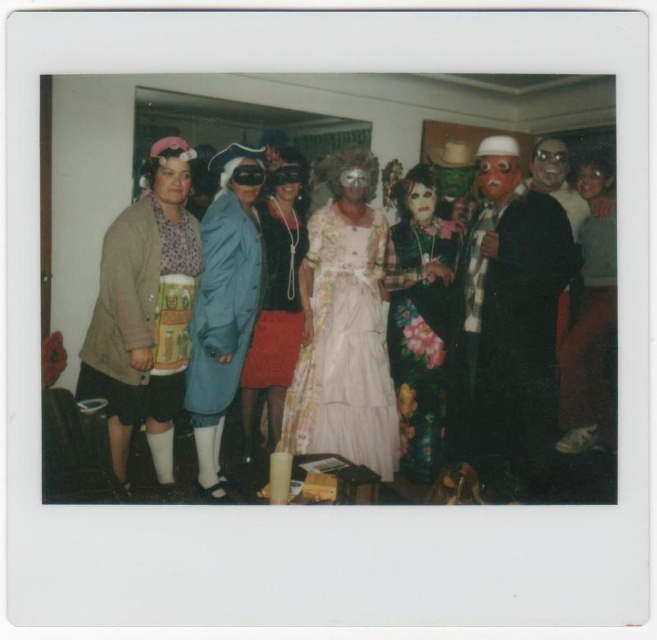
Question: Does floral fabric dress at center appear on the left side of velvet black dress at center?

Choices:
 (A) yes
 (B) no

Answer: (B)

Question: Which point is farther to the camera?

Choices:
 (A) matte blue coat at center
 (B) floral lace dress at center
 (C) floral-patterned dress at center

Answer: (B)

Question: Does matte black mask at center lie behind floral lace dress at center?

Choices:
 (A) no
 (B) yes

Answer: (A)

Question: Does floral fabric dress at center come in front of matte brown sweater at left?

Choices:
 (A) no
 (B) yes

Answer: (B)

Question: Which of the following is the closest to the observer?

Choices:
 (A) matte black mask at center
 (B) floral fabric dress at center
 (C) floral-patterned dress at center
 (D) velvet black dress at center

Answer: (B)

Question: Which point appears closest to the camera in this image?

Choices:
 (A) (373, 346)
 (B) (549, 205)
 (C) (290, 285)

Answer: (B)